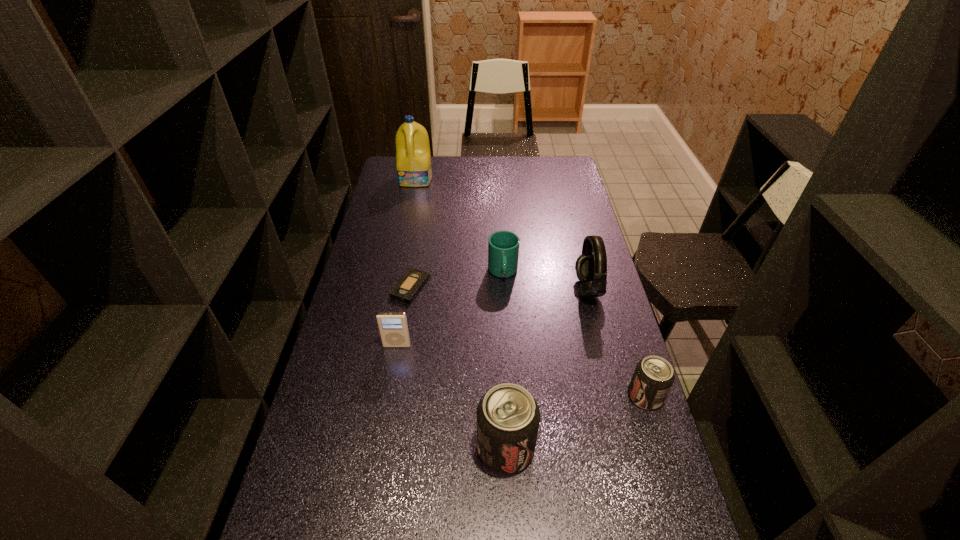
Where is `vacant space situated 0.060m on the left of the nearer soda can`? vacant space situated 0.060m on the left of the nearer soda can is located at coordinates (453, 448).

Where is `vacant region located 0.260m on the left of the sixth farthest object`? This screenshot has height=540, width=960. vacant region located 0.260m on the left of the sixth farthest object is located at coordinates (534, 396).

Where is `vacant space situated 0.240m on the label of the farthest object`? Image resolution: width=960 pixels, height=540 pixels. vacant space situated 0.240m on the label of the farthest object is located at coordinates (409, 219).

Identify the location of vacant space located 0.090m on the handle side of the cup. (505, 305).

Identify the location of free region located on the earcups of the headset. This screenshot has width=960, height=540. (556, 289).

Identify the location of free point located on the earcups of the headset. The image size is (960, 540). point(562,289).

This screenshot has width=960, height=540. I want to click on vacant space located on the earcups of the headset, so click(x=539, y=289).

Find the location of a particular element. vacant space located 0.230m on the front-facing side of the fifth farthest object is located at coordinates (385, 417).

At what (x,y) coordinates should I click in order to perform the action: click on vacant space located on the right of the shortest object. Please return your answer as a coordinate pair (x, y). Looking at the image, I should click on (504, 287).

Where is `object located at the far edge`? The image size is (960, 540). object located at the far edge is located at coordinates (413, 159).